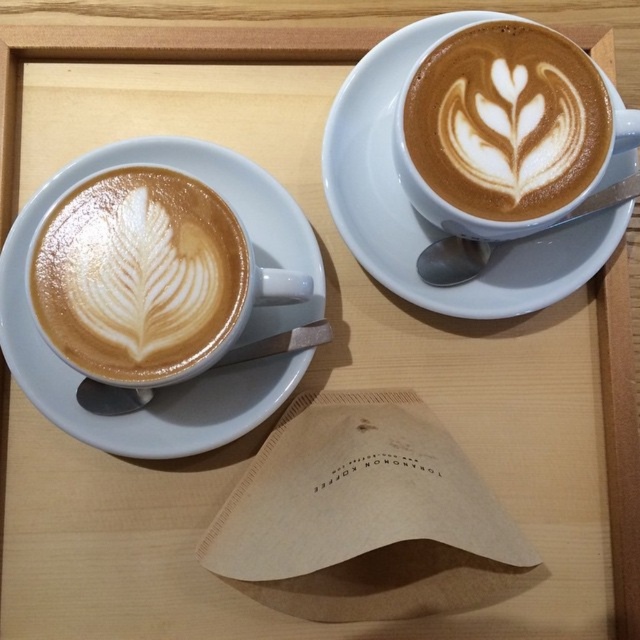
Which of these two, matte white cup at left or white ceramic saucer at lower left, stands taller?

With more height is white ceramic saucer at lower left.

Based on the photo, which is more to the left, matte white cup at left or white ceramic saucer at lower left?

matte white cup at left is more to the left.

The width and height of the screenshot is (640, 640). Find the location of `matte white cup at left`. matte white cup at left is located at coordinates (138, 275).

Find the location of a particular element. matte white cup at left is located at coordinates (138, 275).

Between white ceramic saucer at lower left and latte art at upper right, which one is positioned higher?

Positioned higher is latte art at upper right.

Between point (51, 406) and point (531, 148), which one is positioned in front?

Point (531, 148) is more forward.

Is point (19, 378) closer to viewer compared to point (497, 180)?

No, (19, 378) is behind (497, 180).

Where is `white ceramic saucer at lower left`? white ceramic saucer at lower left is located at coordinates point(236,340).

Is matte white cup at left wider than latte art at upper right?

Correct, the width of matte white cup at left exceeds that of latte art at upper right.

Can you confirm if matte white cup at left is positioned above latte art at upper right?

No, matte white cup at left is not above latte art at upper right.

This screenshot has width=640, height=640. In order to click on matte white cup at left in this screenshot , I will do [x=138, y=275].

I want to click on matte white cup at left, so click(138, 275).